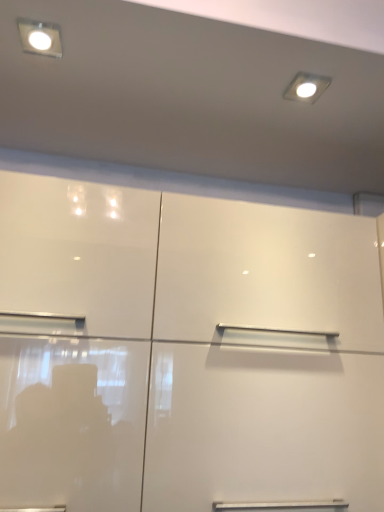
What do you see at coordinates (185, 350) in the screenshot?
I see `glossy white cupboard at center` at bounding box center [185, 350].

In order to click on glossy white cupboard at center in this screenshot , I will do (x=185, y=350).

Could you tell me if matte white square at upper left is facing glossy white cupboard at center?

A: No, matte white square at upper left does not turn towards glossy white cupboard at center.

How many degrees apart are the facing directions of matte white square at upper left and glossy white cupboard at center?

The angular difference between matte white square at upper left and glossy white cupboard at center is 0.967 degrees.

From the image's perspective, which is above, matte white square at upper left or glossy white cupboard at center?

matte white square at upper left appears higher in the image.

Based on the photo, are matte white square at upper left and glossy white cupboard at center making contact?

No.

Does point (295, 90) come closer to viewer compared to point (190, 346)?

No, it is not.

Visually, is matte white light fixture at upper right positioned to the left or to the right of glossy white cupboard at center?

Based on their positions, matte white light fixture at upper right is located to the right of glossy white cupboard at center.

How many degrees apart are the facing directions of matte white light fixture at upper right and glossy white cupboard at center?

The angle between the facing direction of matte white light fixture at upper right and the facing direction of glossy white cupboard at center is 5.8 degrees.

Is matte white light fixture at upper right wider than glossy white cupboard at center?

No.

Locate an element on the screen. Image resolution: width=384 pixels, height=512 pixels. light fixture that is above the glossy white cupboard at center (from a real-world perspective) is located at coordinates (40, 38).

Is the surface of glossy white cupboard at center in direct contact with matte white square at upper left?

No, glossy white cupboard at center is not touching matte white square at upper left.

Considering the points (193, 398) and (48, 40), which point is behind, point (193, 398) or point (48, 40)?

The point (48, 40) is farther from the camera.

Is glossy white cupboard at center with matte white light fixture at upper right?

No, glossy white cupboard at center is not touching matte white light fixture at upper right.

Can you confirm if glossy white cupboard at center is taller than matte white light fixture at upper right?

Yes, glossy white cupboard at center is taller than matte white light fixture at upper right.

Which object is wider, glossy white cupboard at center or matte white light fixture at upper right?

With larger width is glossy white cupboard at center.

Which is more to the left, matte white square at upper left or matte white light fixture at upper right?

matte white square at upper left is more to the left.

Is matte white square at upper left inside the boundaries of matte white light fixture at upper right, or outside?

matte white square at upper left is located beyond the bounds of matte white light fixture at upper right.

Are matte white square at upper left and matte white light fixture at upper right far apart?

No.

Can you tell me how much matte white square at upper left and matte white light fixture at upper right differ in facing direction?

The angle between the facing direction of matte white square at upper left and the facing direction of matte white light fixture at upper right is 4.83 degrees.

Can we say matte white light fixture at upper right lies outside matte white square at upper left?

Absolutely, matte white light fixture at upper right is external to matte white square at upper left.

Does matte white light fixture at upper right have a greater height compared to matte white square at upper left?

Incorrect, the height of matte white light fixture at upper right is not larger of that of matte white square at upper left.

Where is `lighting below the matte white square at upper left (from the image's perspective)`? This screenshot has height=512, width=384. lighting below the matte white square at upper left (from the image's perspective) is located at coordinates (306, 87).

How many degrees apart are the facing directions of matte white light fixture at upper right and matte white square at upper left?

The facing directions of matte white light fixture at upper right and matte white square at upper left are 4.83 degrees apart.

Locate an element on the screen. light fixture that is behind the glossy white cupboard at center is located at coordinates (40, 38).

Find the location of a particular element. lighting above the glossy white cupboard at center (from a real-world perspective) is located at coordinates (306, 87).

Looking at the image, which one is located further to glossy white cupboard at center, matte white square at upper left or matte white light fixture at upper right?

matte white square at upper left lies further to glossy white cupboard at center than the other object.

Considering their positions, is matte white light fixture at upper right positioned further to glossy white cupboard at center than matte white square at upper left?

Based on the image, matte white square at upper left appears to be further to glossy white cupboard at center.

Considering their positions, is matte white light fixture at upper right positioned closer to matte white square at upper left than glossy white cupboard at center?

matte white light fixture at upper right is positioned closer to the anchor matte white square at upper left.

Which object lies further to the anchor point matte white light fixture at upper right, glossy white cupboard at center or matte white square at upper left?

glossy white cupboard at center lies further to matte white light fixture at upper right than the other object.

Considering their positions, is glossy white cupboard at center positioned closer to matte white square at upper left than matte white light fixture at upper right?

matte white light fixture at upper right lies closer to matte white square at upper left than the other object.

From the image, which object appears to be nearer to matte white light fixture at upper right, matte white square at upper left or glossy white cupboard at center?

Among the two, matte white square at upper left is located nearer to matte white light fixture at upper right.

At what (x,y) coordinates should I click in order to perform the action: click on lighting that lies between matte white square at upper left and glossy white cupboard at center from top to bottom. Please return your answer as a coordinate pair (x, y). The width and height of the screenshot is (384, 512). Looking at the image, I should click on (306, 87).